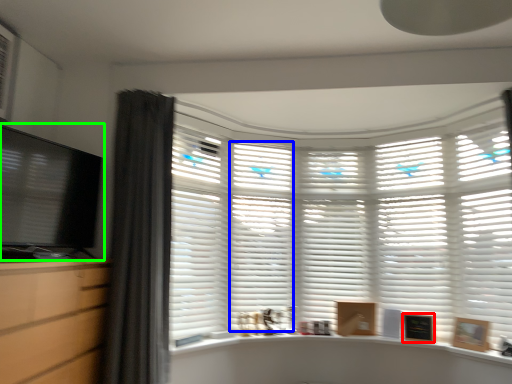
Question: Which object is positioned farthest from picture frame (highlighted by a red box)? Select from shutter (highlighted by a blue box) and computer monitor (highlighted by a green box).

Choices:
 (A) shutter
 (B) computer monitor

Answer: (B)